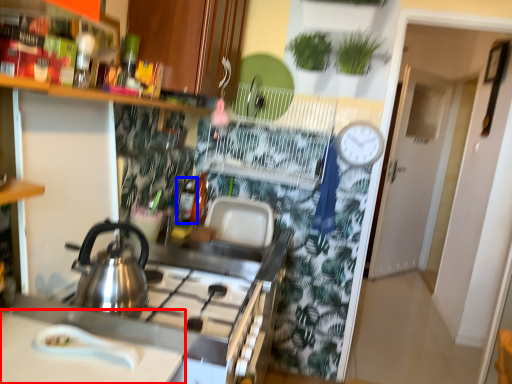
Question: Which point is closer to the camera, countertop (highlighted by a red box) or bottle (highlighted by a blue box)?

Choices:
 (A) countertop
 (B) bottle

Answer: (A)